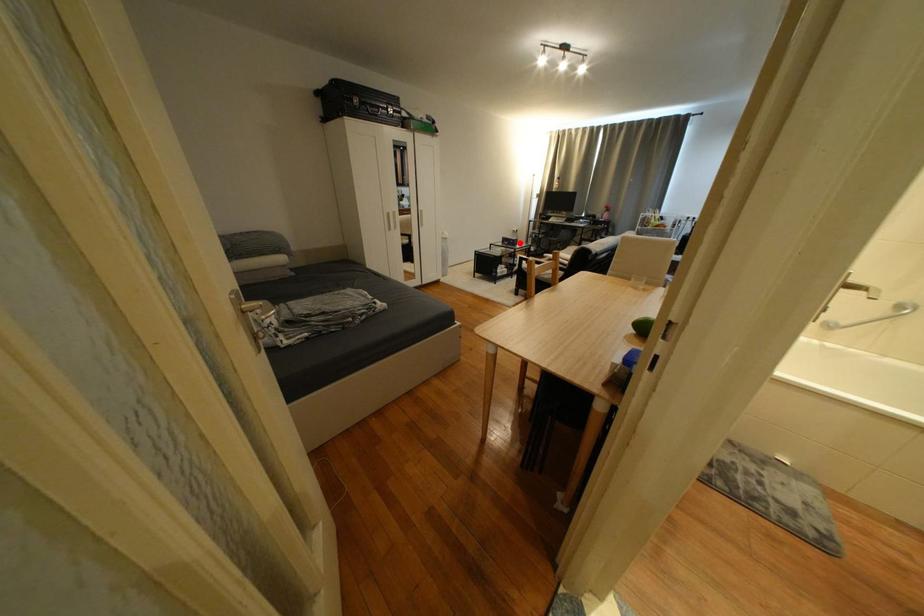
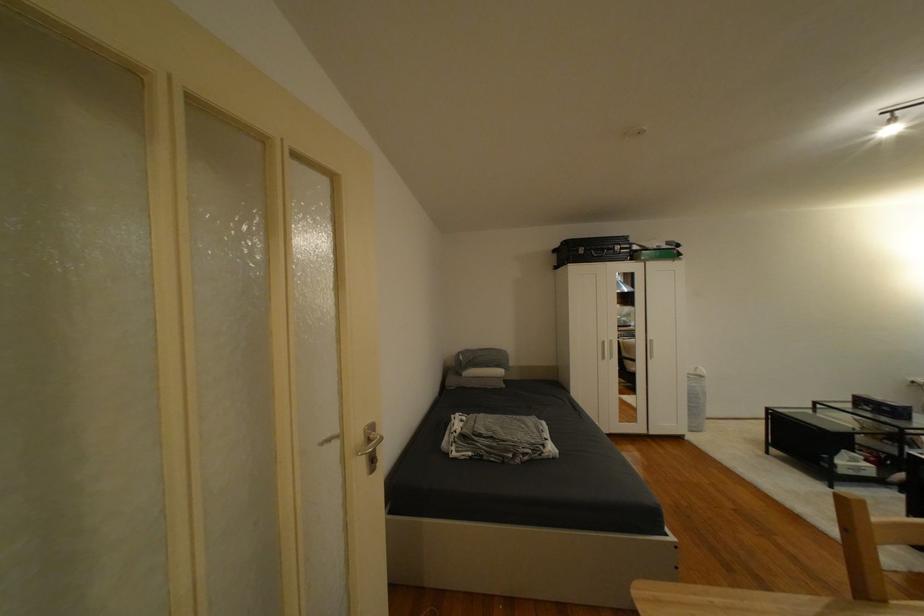
Question: I am providing you with two images of the same scene from different viewpoints. A red point is shown in image1. For the corresponding object point in image2, is it positioned nearer or farther from the camera?

Choices:
 (A) Nearer
 (B) Farther

Answer: (B)